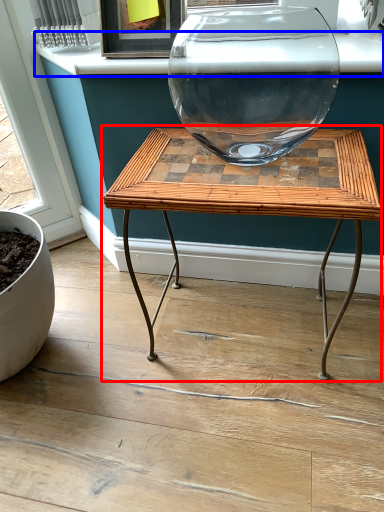
Question: Which of the following is the farthest to the observer, table (highlighted by a red box) or window sill (highlighted by a blue box)?

Choices:
 (A) table
 (B) window sill

Answer: (B)